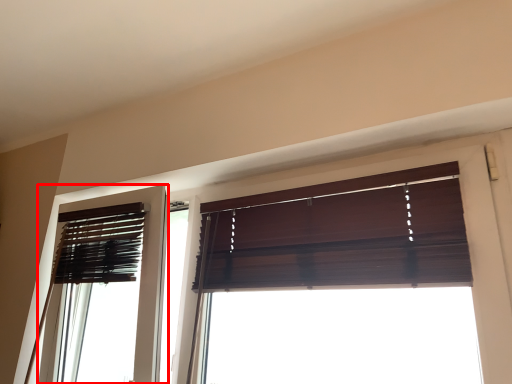
Question: From the image's perspective, where is screen door (annotated by the red box) located in relation to window in the image?

Choices:
 (A) above
 (B) below

Answer: (B)